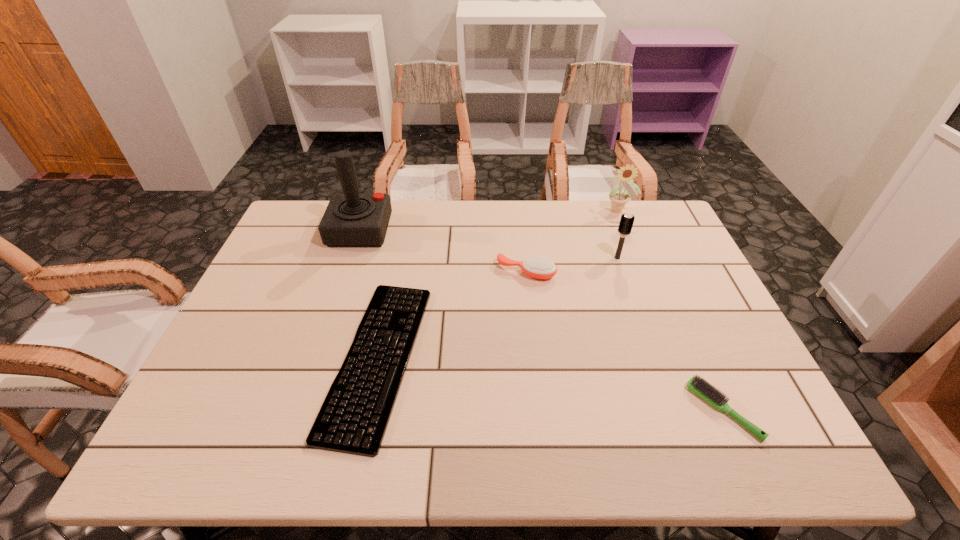
Where is `free space between the leftmost hairbrush and the computer keyboard`? This screenshot has width=960, height=540. free space between the leftmost hairbrush and the computer keyboard is located at coordinates (452, 315).

Identify the location of free space between the tallest object and the tallest hairbrush. This screenshot has height=540, width=960. (489, 244).

I want to click on the closest object to the nearest hairbrush, so click(x=535, y=267).

I want to click on the closest object to the leftmost hairbrush, so click(626, 222).

Identify the location of the second closest hairbrush to the sunflower. This screenshot has height=540, width=960. (535, 267).

Choose which hairbrush is the second nearest neighbor to the nearest hairbrush. Please provide its 2D coordinates. Your answer should be formatted as a tuple, i.e. [(x, y)], where the tuple contains the x and y coordinates of a point satisfying the conditions above.

[(626, 222)]

Image resolution: width=960 pixels, height=540 pixels. I want to click on vacant position in the image that satisfies the following two spatial constraints: 1. on the front-facing side of the second shortest object; 2. on the right side of the fifth shortest object, so click(x=699, y=410).

You are a GUI agent. You are given a task and a screenshot of the screen. Output one action in this format:
    pyautogui.click(x=<x>, y=<y>)
    Task: Click on the vacant region that satisfies the following two spatial constraints: 1. on the base of the tallest object; 2. on the back side of the fifth tallest object
    
    Given the screenshot: What is the action you would take?
    pyautogui.click(x=300, y=410)

The height and width of the screenshot is (540, 960). Identify the location of vacant point that satisfies the following two spatial constraints: 1. on the base of the joystick; 2. on the right side of the leftmost hairbrush. (347, 272).